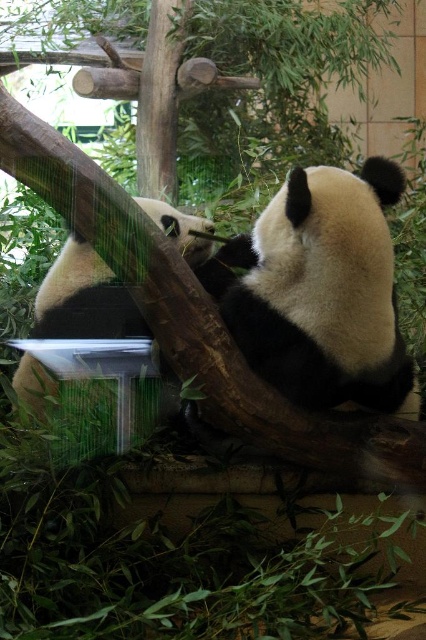
Which of these two, black matte panda at center or black and white fur panda at center, stands shorter?

black matte panda at center

Is point (336, 289) positioned in front of point (276, 250)?

Yes, point (336, 289) is in front of point (276, 250).

Locate an element on the screen. The height and width of the screenshot is (640, 426). black matte panda at center is located at coordinates (319, 291).